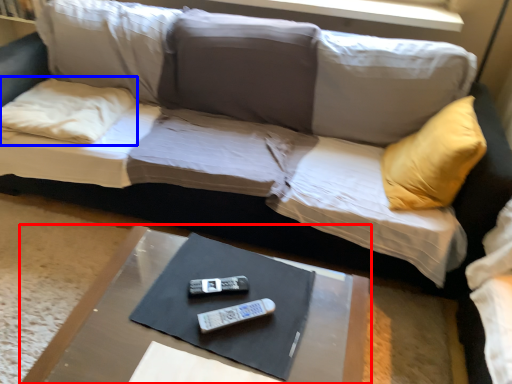
Question: Which object is further to the camera taking this photo, table (highlighted by a red box) or pillow (highlighted by a blue box)?

Choices:
 (A) table
 (B) pillow

Answer: (B)